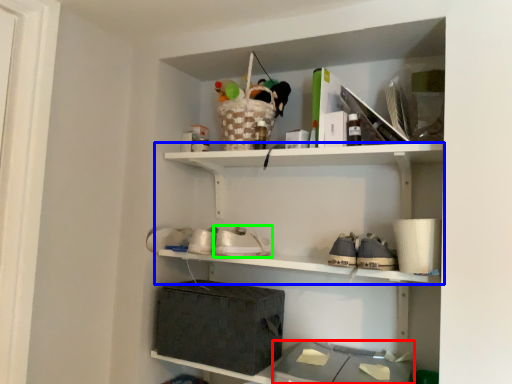
Question: Which object is positioned farthest from storage box (highlighted by a red box)? Select from shelf (highlighted by a blue box) and shoe (highlighted by a green box).

Choices:
 (A) shelf
 (B) shoe

Answer: (A)